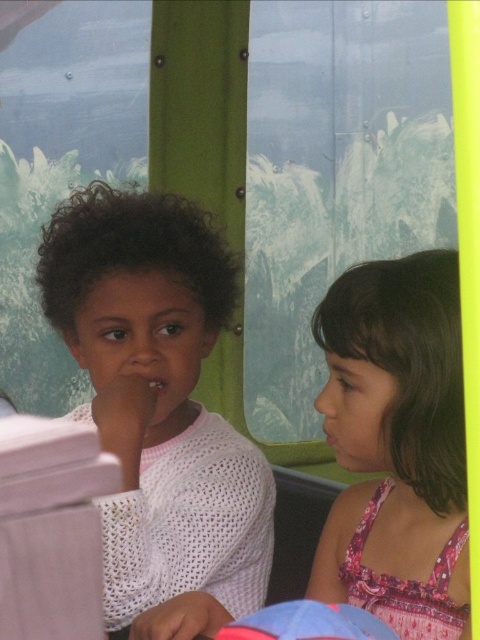
Does point (219, 488) come farther from viewer compared to point (328, 525)?

That is False.

Does white knitted sweater at center have a lesser height compared to pink floral dress at right?

No, white knitted sweater at center is not shorter than pink floral dress at right.

Find the location of a particular element. white knitted sweater at center is located at coordinates (158, 397).

You are a GUI agent. You are given a task and a screenshot of the screen. Output one action in this format:
    pyautogui.click(x=<x>, y=<y>)
    Task: Click on the white knitted sweater at center
    Image resolution: width=480 pixels, height=640 pixels.
    Given the screenshot: What is the action you would take?
    pyautogui.click(x=158, y=397)